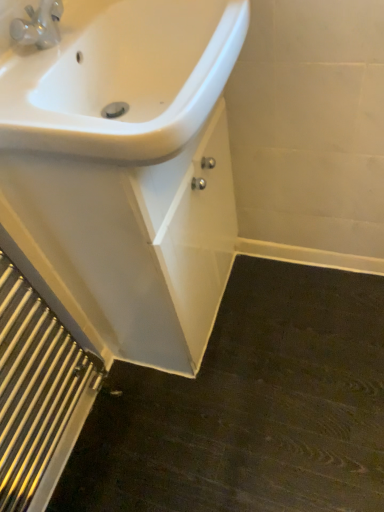
Identify the location of white glossy sink at upper left. Image resolution: width=384 pixels, height=512 pixels. (130, 176).

The height and width of the screenshot is (512, 384). Describe the element at coordinates (37, 392) in the screenshot. I see `polished silver radiator at lower left` at that location.

At what (x,y) coordinates should I click in order to perform the action: click on white glossy sink at upper left. Please return your answer as a coordinate pair (x, y). Image resolution: width=384 pixels, height=512 pixels. Looking at the image, I should click on pyautogui.click(x=122, y=78).

The height and width of the screenshot is (512, 384). I want to click on white glossy sink at upper left, so click(130, 176).

In the scene shown: Between white glossy sink at upper left and white glossy sink at upper left, which one has less height?

white glossy sink at upper left.

Is white glossy sink at upper left further to camera compared to white glossy sink at upper left?

Yes.

Where is `porcelain that appears behind the white glossy sink at upper left`? Image resolution: width=384 pixels, height=512 pixels. porcelain that appears behind the white glossy sink at upper left is located at coordinates (130, 176).

From a real-world perspective, is white glossy sink at upper left on top of white glossy sink at upper left?

Actually, white glossy sink at upper left is physically below white glossy sink at upper left in the real world.

Which is nearer, (x=241, y=36) or (x=49, y=419)?

The point (x=241, y=36) is more forward.

Can you see white glossy sink at upper left touching polished silver radiator at lower left?

No, white glossy sink at upper left is not making contact with polished silver radiator at lower left.

Is white glossy sink at upper left in front of polished silver radiator at lower left?

No.

From the image's perspective, is white glossy sink at upper left positioned above or below polished silver radiator at lower left?

white glossy sink at upper left is above polished silver radiator at lower left.

Consider the image. Can you see polished silver radiator at lower left touching white glossy sink at upper left?

No, polished silver radiator at lower left is not with white glossy sink at upper left.

Considering the positions of objects polished silver radiator at lower left and white glossy sink at upper left in the image provided, who is behind, polished silver radiator at lower left or white glossy sink at upper left?

white glossy sink at upper left is further away from the camera.

Is point (99, 364) farther from camera compared to point (55, 81)?

Yes, point (99, 364) is farther from viewer.

From the image's perspective, which is below, polished silver radiator at lower left or white glossy sink at upper left?

polished silver radiator at lower left.

From a real-world perspective, is polished silver radiator at lower left above or below white glossy sink at upper left?

Clearly, from a real-world perspective, polished silver radiator at lower left is below white glossy sink at upper left.

Between polished silver radiator at lower left and white glossy sink at upper left, which one has smaller size?

With smaller size is polished silver radiator at lower left.

Looking at this image, is white glossy sink at upper left surrounded by polished silver radiator at lower left?

That's incorrect, white glossy sink at upper left is not inside polished silver radiator at lower left.

Does white glossy sink at upper left turn towards polished silver radiator at lower left?

No.

Is white glossy sink at upper left closer to camera compared to polished silver radiator at lower left?

Yes, white glossy sink at upper left is closer to the viewer.

In the scene shown: Between white glossy sink at upper left and polished silver radiator at lower left, which one has less height?

With less height is white glossy sink at upper left.

From the image's perspective, which is above, white glossy sink at upper left or polished silver radiator at lower left?

white glossy sink at upper left.

Would you say white glossy sink at upper left contains white glossy sink at upper left?

No, white glossy sink at upper left does not contain white glossy sink at upper left.

Is white glossy sink at upper left oriented away from white glossy sink at upper left?

No, white glossy sink at upper left is not facing away from white glossy sink at upper left.

Considering the sizes of white glossy sink at upper left and white glossy sink at upper left in the image, is white glossy sink at upper left bigger or smaller than white glossy sink at upper left?

Considering their sizes, white glossy sink at upper left takes up less space than white glossy sink at upper left.

Is point (165, 44) closer or farther from the camera than point (232, 25)?

Point (165, 44).

Identify the location of porcelain below the white glossy sink at upper left (from a real-world perspective). (130, 176).

This screenshot has width=384, height=512. What are the coordinates of `radiator that appears on the left of white glossy sink at upper left` in the screenshot? It's located at tap(37, 392).

Looking at the image, which one is located further to white glossy sink at upper left, white glossy sink at upper left or polished silver radiator at lower left?

polished silver radiator at lower left lies further to white glossy sink at upper left than the other object.

Based on their spatial positions, is white glossy sink at upper left or white glossy sink at upper left further from polished silver radiator at lower left?

Among the two, white glossy sink at upper left is located further to polished silver radiator at lower left.

Looking at the image, which one is located further to polished silver radiator at lower left, white glossy sink at upper left or white glossy sink at upper left?

Based on the image, white glossy sink at upper left appears to be further to polished silver radiator at lower left.

In the scene shown: When comparing their distances from white glossy sink at upper left, does polished silver radiator at lower left or white glossy sink at upper left seem closer?

white glossy sink at upper left.

Considering their positions, is white glossy sink at upper left positioned further to white glossy sink at upper left than polished silver radiator at lower left?

polished silver radiator at lower left is positioned further to the anchor white glossy sink at upper left.

Looking at this image, when comparing their distances from white glossy sink at upper left, does polished silver radiator at lower left or white glossy sink at upper left seem closer?

The object closer to white glossy sink at upper left is white glossy sink at upper left.

In order to click on porcelain between white glossy sink at upper left and polished silver radiator at lower left in the up-down direction in this screenshot , I will do `click(130, 176)`.